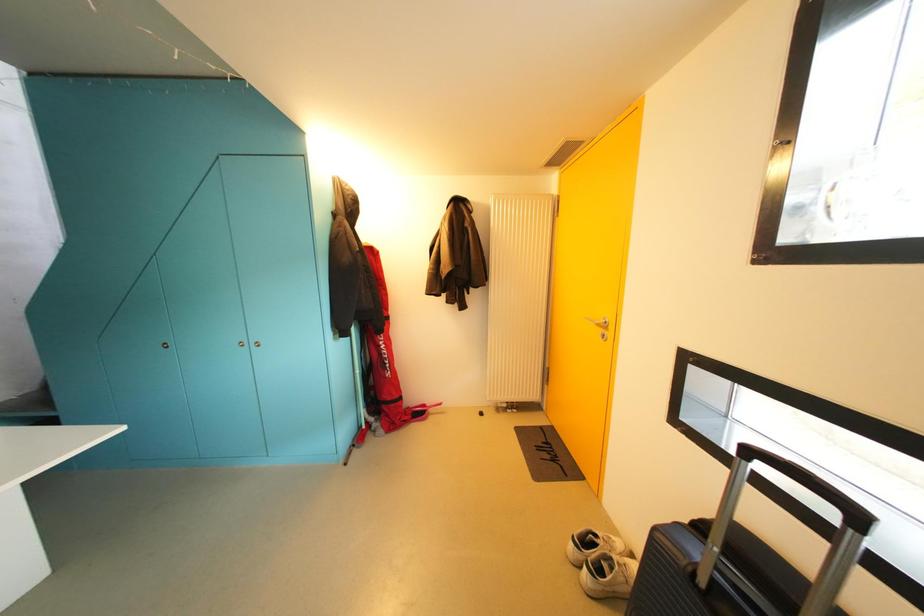
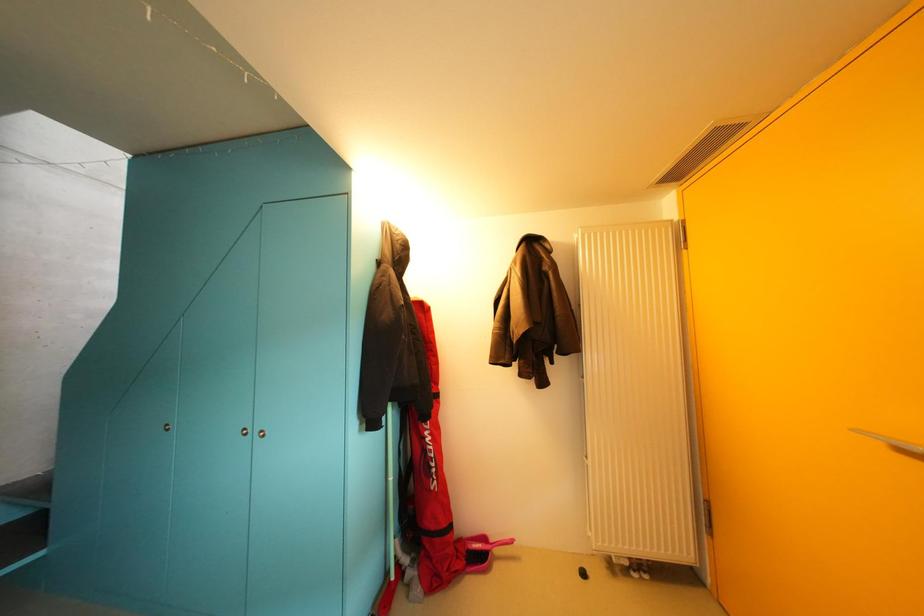
Question: In a continuous first-person perspective shot, in which direction is the camera moving?

Choices:
 (A) Left
 (B) Right
 (C) Forward
 (D) Backward

Answer: (C)